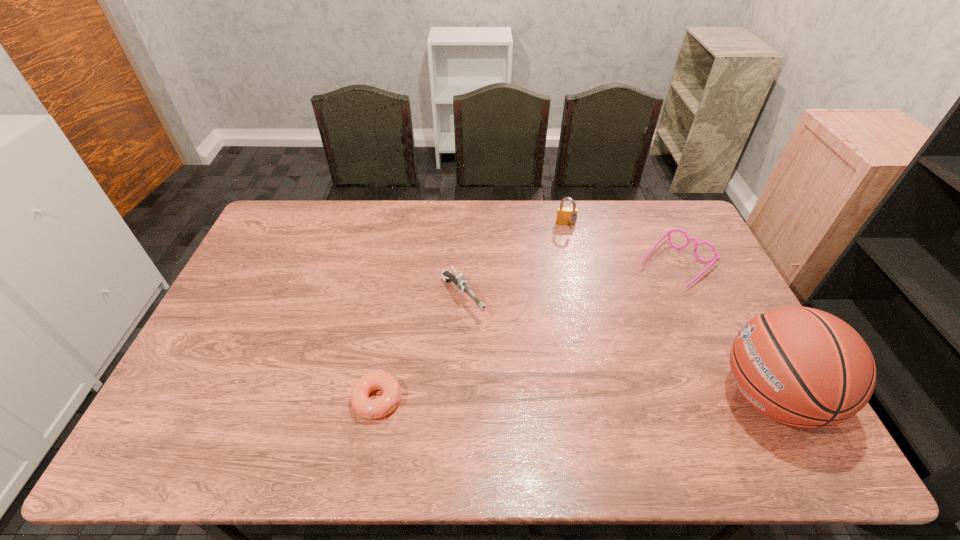
Where is `vacant space situated on the arms of the spectacles`? vacant space situated on the arms of the spectacles is located at coordinates (642, 298).

At what (x,y) coordinates should I click in order to perform the action: click on padlock that is positioned at the far edge. Please return your answer as a coordinate pair (x, y). The image size is (960, 540). Looking at the image, I should click on (565, 216).

Image resolution: width=960 pixels, height=540 pixels. I want to click on spectacles that is at the far edge, so click(716, 257).

Where is `doughnut positioned at the near edge`? This screenshot has width=960, height=540. doughnut positioned at the near edge is located at coordinates (368, 408).

This screenshot has height=540, width=960. In order to click on basketball that is at the near edge in this screenshot , I will do `click(803, 367)`.

Where is `basketball situated at the right edge`? This screenshot has height=540, width=960. basketball situated at the right edge is located at coordinates (803, 367).

Find the location of a particular element. This screenshot has height=540, width=960. spectacles at the right edge is located at coordinates (716, 257).

This screenshot has width=960, height=540. Find the location of `object present at the far right corner`. object present at the far right corner is located at coordinates (716, 257).

Locate an element on the screen. object that is at the near right corner is located at coordinates (803, 367).

The height and width of the screenshot is (540, 960). In order to click on free spot at the far edge of the desktop in this screenshot , I will do `click(385, 211)`.